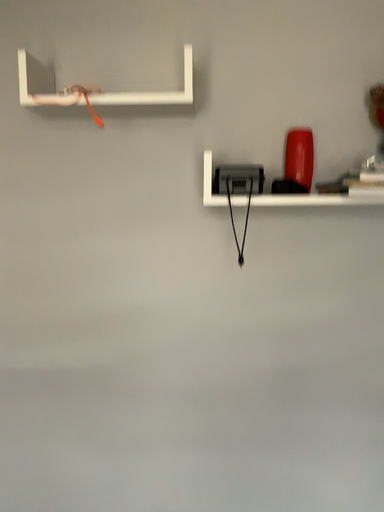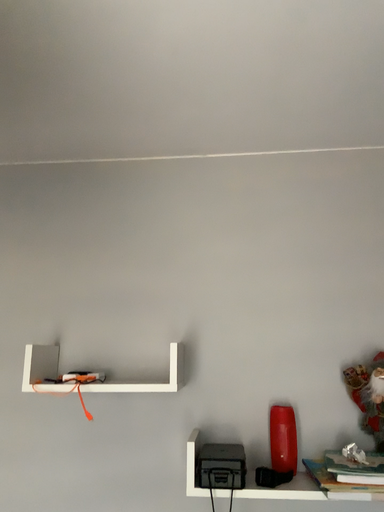
Question: Which way did the camera rotate in the video?

Choices:
 (A) rotated downward
 (B) rotated upward

Answer: (B)